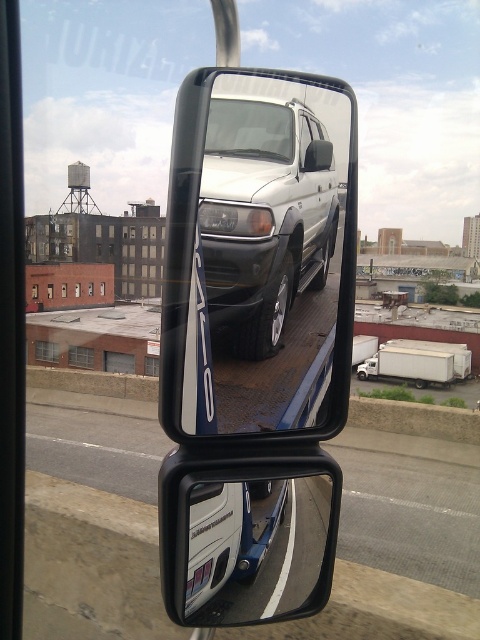
You are standing in front of a vehicle with two side mirrors. You notice a point marked at coordinates (254,547). Based on the scene, where is this point located?

The point at coordinates (254,547) is on the glossy metallic van at lower right.

You are a delivery driver who needs to park your truck between the satin silver suv at center and the glossy metallic van at lower right. Can you fit your truck which is 2.5 meters wide in the space between them?

The satin silver suv at center is narrower than the glossy metallic van at lower right, but the exact width difference isn not specified. Without knowing the actual widths, it is impossible to determine if the space between them can accommodate a 2.5 meter wide truck.

You are a delivery driver who needs to check the distance between the satin silver suv at center and the white plastic license plate at lower center before attaching a new license plate. Based on the scene, can you determine which one is closer to you?

The satin silver suv at center is closer to the viewer than the white plastic license plate at lower center, so the SUV is nearer when attaching the new license plate.